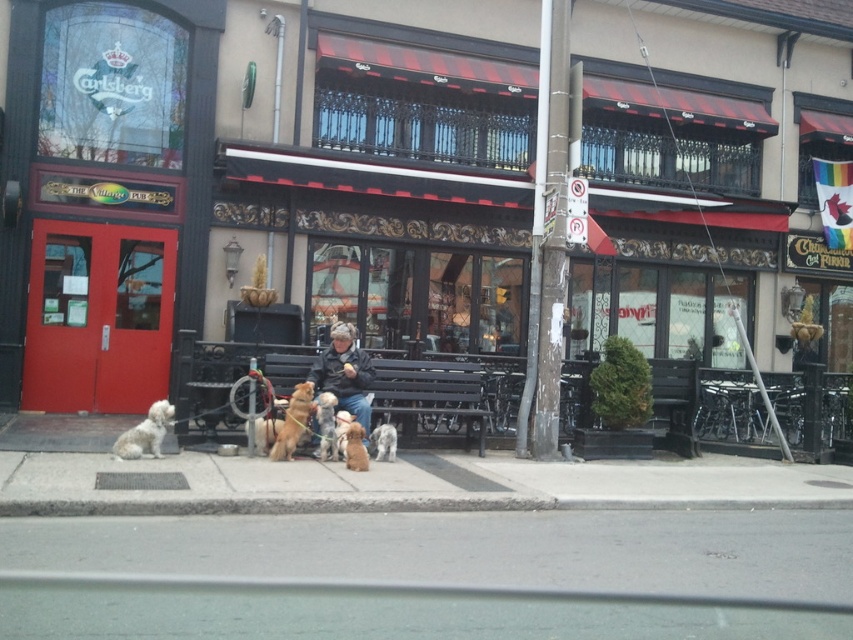
Is point (370, 499) positioned in front of point (347, 428)?

Yes, it is.

Which of these two, gray concrete curb at lower center or golden fur dog at center, stands shorter?

gray concrete curb at lower center

Locate an element on the screen. The image size is (853, 640). gray concrete curb at lower center is located at coordinates (381, 504).

Is golden fur dog at center to the right of soft beige fur at center from the viewer's perspective?

In fact, golden fur dog at center is to the left of soft beige fur at center.

Is the position of golden fur dog at center more distant than that of soft beige fur at center?

No, golden fur dog at center is closer to the viewer.

Is point (347, 451) closer to camera compared to point (375, 433)?

That is True.

Locate an element on the screen. The image size is (853, 640). golden fur dog at center is located at coordinates coord(355,448).

Between point (566, 497) and point (375, 456), which one is positioned in front?

Positioned in front is point (566, 497).

Based on the photo, is gray concrete curb at lower center shorter than soft beige fur at center?

Indeed, gray concrete curb at lower center has a lesser height compared to soft beige fur at center.

This screenshot has width=853, height=640. What do you see at coordinates (381, 504) in the screenshot? I see `gray concrete curb at lower center` at bounding box center [381, 504].

Where is `gray concrete curb at lower center`? This screenshot has height=640, width=853. gray concrete curb at lower center is located at coordinates click(x=381, y=504).